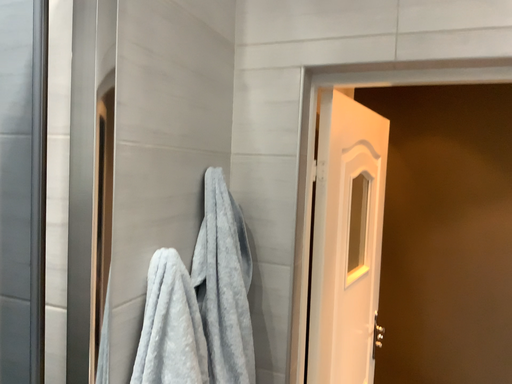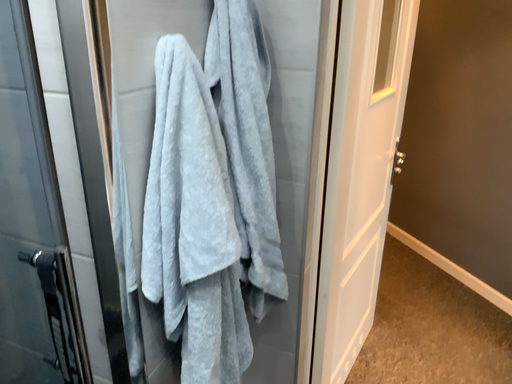
Question: How did the camera likely rotate when shooting the video?

Choices:
 (A) rotated upward
 (B) rotated downward

Answer: (B)